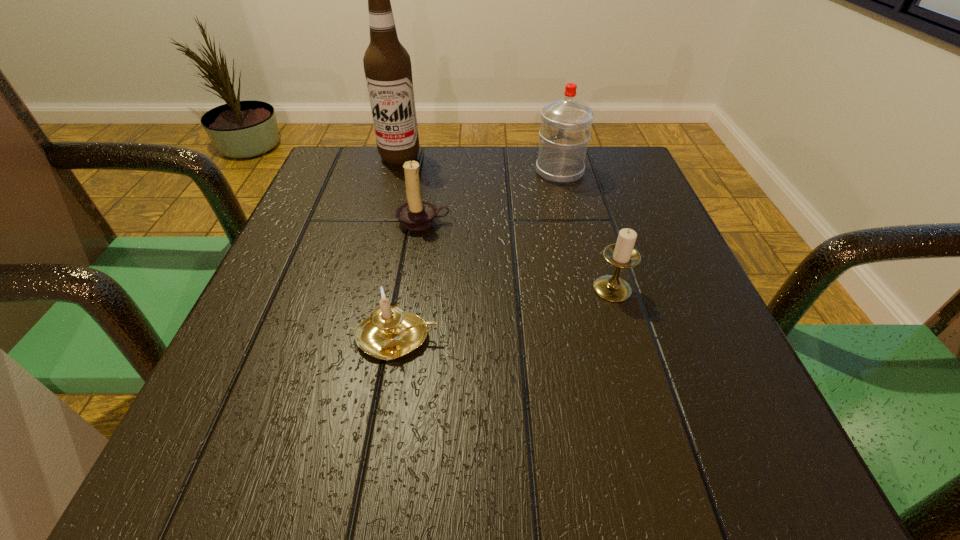
At what (x,y) coordinates should I click in order to perform the action: click on vacant space at the left edge. Please return your answer as a coordinate pair (x, y). The width and height of the screenshot is (960, 540). Looking at the image, I should click on (304, 205).

Find the location of a particular element. The width and height of the screenshot is (960, 540). vacant point at the right edge is located at coordinates (656, 396).

Where is `free space at the far left corner of the desktop`? The width and height of the screenshot is (960, 540). free space at the far left corner of the desktop is located at coordinates (335, 166).

Locate an element on the screen. This screenshot has width=960, height=540. vacant region at the near left corner is located at coordinates 300,453.

Find the location of a particular element. The height and width of the screenshot is (540, 960). free space at the far right corner of the desktop is located at coordinates (642, 178).

Where is `free spot at the near right corner of the desktop`? The width and height of the screenshot is (960, 540). free spot at the near right corner of the desktop is located at coordinates (776, 467).

Identify the location of vacant space that is in between the shortest object and the fourth shortest object. This screenshot has width=960, height=540. (479, 255).

Locate an element on the screen. The width and height of the screenshot is (960, 540). free space between the fourth farthest object and the third nearest object is located at coordinates (517, 255).

Locate an element on the screen. vacant region between the tallest object and the fourth shortest object is located at coordinates (480, 164).

This screenshot has width=960, height=540. I want to click on empty location between the second tallest object and the shortest candle holder, so click(479, 255).